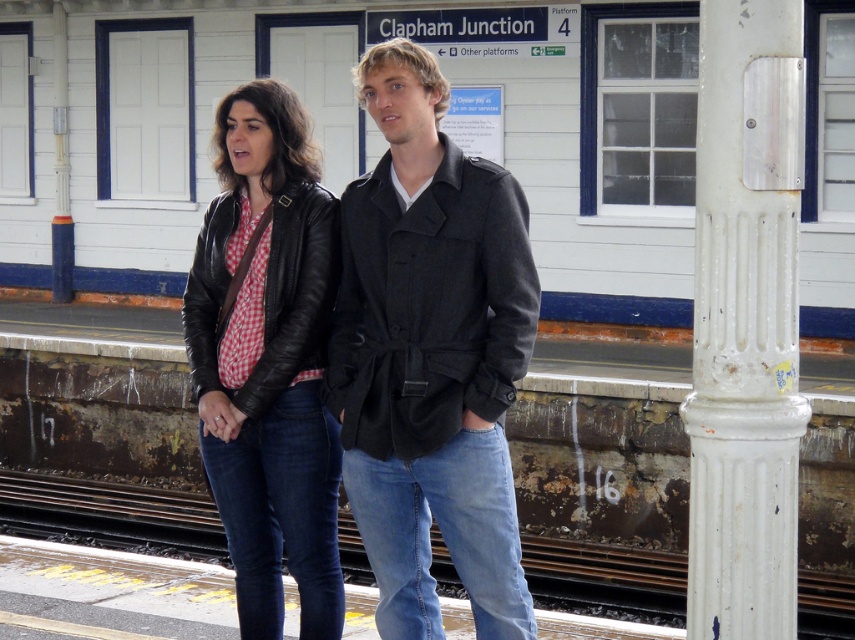
Question: Can you confirm if matte black jacket at center is bigger than leather jacket at center?

Choices:
 (A) no
 (B) yes

Answer: (B)

Question: Which object is the closest to the leather jacket at center?

Choices:
 (A) matte black jacket at center
 (B) white painted metal pole at right
 (C) rusty metal train track at lower center

Answer: (A)

Question: Which object appears farthest from the camera in this image?

Choices:
 (A) leather jacket at center
 (B) rusty metal train track at lower center

Answer: (B)

Question: Based on their relative distances, which object is nearer to the matte black jacket at center?

Choices:
 (A) leather jacket at center
 (B) white painted metal pole at right

Answer: (A)

Question: Can you confirm if white painted metal pole at right is thinner than rusty metal train track at lower center?

Choices:
 (A) yes
 (B) no

Answer: (A)

Question: Does leather jacket at center appear over rusty metal train track at lower center?

Choices:
 (A) yes
 (B) no

Answer: (A)